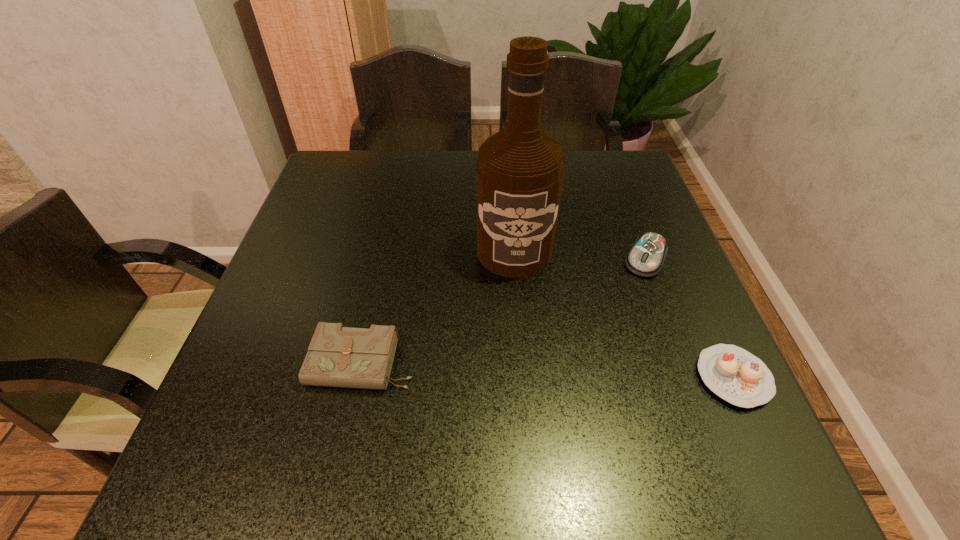
The image size is (960, 540). I want to click on vacant position located on the label of the second object from left to right, so click(x=516, y=321).

Identify the location of blank area located on the label of the second object from left to right. The image size is (960, 540). (516, 317).

Where is `blank space located on the label of the second object from left to right`? This screenshot has width=960, height=540. blank space located on the label of the second object from left to right is located at coordinates (520, 430).

Locate an element on the screen. This screenshot has width=960, height=540. diary at the near edge is located at coordinates (338, 356).

Find the location of a particular element. cupcake that is positioned at the near edge is located at coordinates (737, 376).

The height and width of the screenshot is (540, 960). I want to click on object that is at the left edge, so pos(338,356).

At what (x,y) coordinates should I click in order to perform the action: click on cupcake that is at the right edge. Please return your answer as a coordinate pair (x, y). This screenshot has width=960, height=540. Looking at the image, I should click on (737, 376).

Find the location of `computer mouse present at the right edge`. computer mouse present at the right edge is located at coordinates (646, 257).

Image resolution: width=960 pixels, height=540 pixels. I want to click on object located in the near left corner section of the desktop, so 338,356.

Locate an element on the screen. object located at the near right corner is located at coordinates (737, 376).